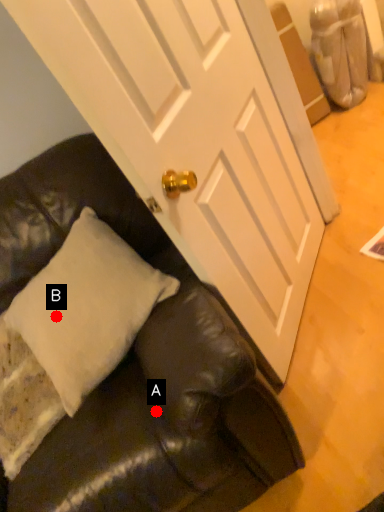
Question: Two points are circled on the image, labeled by A and B beside each circle. Which point is farther from the camera taking this photo?

Choices:
 (A) A is further
 (B) B is further

Answer: (B)